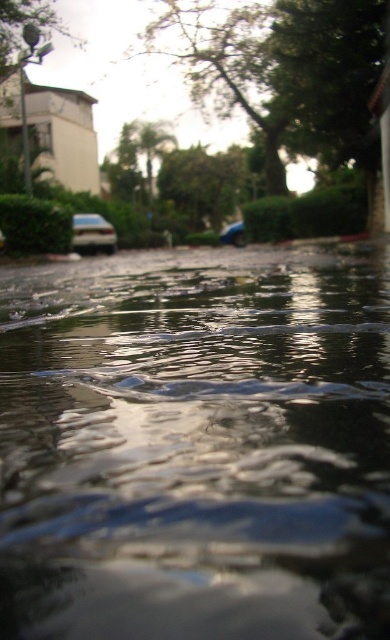
Can you confirm if transparent liquid at center is wider than metallic silver car at lower left?

No, transparent liquid at center is not wider than metallic silver car at lower left.

The image size is (390, 640). Find the location of `transparent liquid at center`. transparent liquid at center is located at coordinates (196, 445).

Who is more distant from viewer, (384, 524) or (95, 234)?

Point (95, 234)

Image resolution: width=390 pixels, height=640 pixels. I want to click on transparent liquid at center, so click(x=196, y=445).

This screenshot has height=640, width=390. Describe the element at coordinates (196, 445) in the screenshot. I see `transparent liquid at center` at that location.

Is transparent liquid at center further to camera compared to metallic blue car at center?

No, transparent liquid at center is closer to the viewer.

The image size is (390, 640). I want to click on transparent liquid at center, so click(x=196, y=445).

Does metallic silver car at lower left appear under metallic blue car at center?

Yes, metallic silver car at lower left is below metallic blue car at center.

Does metallic silver car at lower left appear on the left side of metallic blue car at center?

Yes, metallic silver car at lower left is to the left of metallic blue car at center.

Does point (86, 244) come behind point (221, 234)?

That is False.

Where is `metallic silver car at lower left`? The width and height of the screenshot is (390, 640). metallic silver car at lower left is located at coordinates (92, 234).